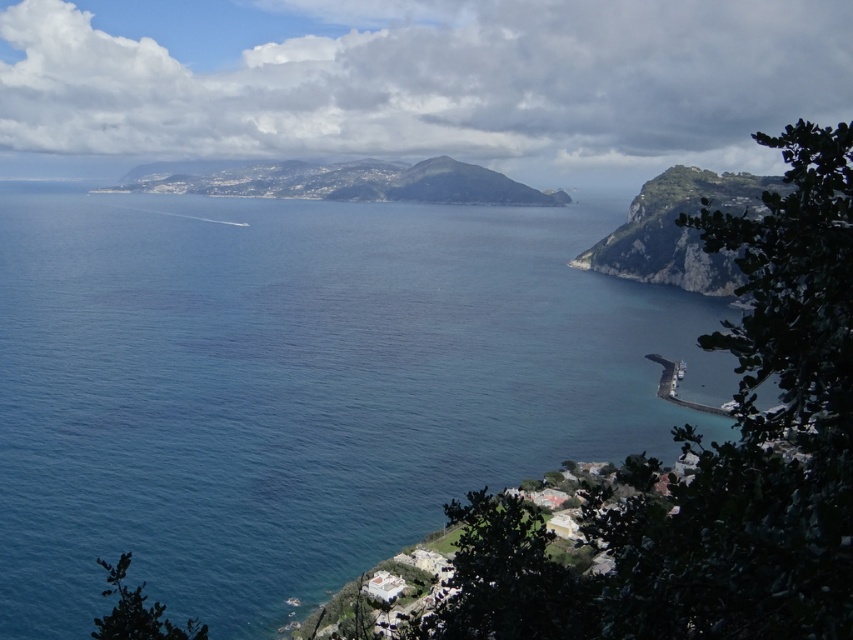
Is point (254, 602) positioned behind point (619, 273)?

No, (254, 602) is closer to viewer.

Who is more forward, [619,392] or [717,275]?

Point [619,392]

Find the location of a particular element. blue water at center is located at coordinates (299, 387).